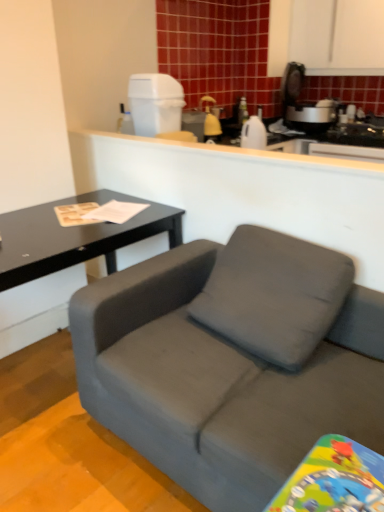
Question: Does black matte table at left appear on the left side of white plastic trash can at upper center, placed as the second appliance when sorted from back to front?

Choices:
 (A) no
 (B) yes

Answer: (B)

Question: From the image's perspective, is black matte table at left on top of white plastic trash can at upper center, placed as the second appliance when sorted from back to front?

Choices:
 (A) yes
 (B) no

Answer: (B)

Question: Considering the relative positions of black matte table at left and white plastic trash can at upper center, positioned as the 1th appliance in left-to-right order, in the image provided, is black matte table at left in front of white plastic trash can at upper center, positioned as the 1th appliance in left-to-right order,?

Choices:
 (A) no
 (B) yes

Answer: (B)

Question: Is black matte table at left turned away from white plastic trash can at upper center, placed as the second appliance when sorted from back to front?

Choices:
 (A) yes
 (B) no

Answer: (B)

Question: Would you say white plastic trash can at upper center, which is counted as the second appliance, starting from the right, is part of black matte table at left's contents?

Choices:
 (A) yes
 (B) no

Answer: (B)

Question: Is black matte table at left further to the viewer compared to white plastic trash can at upper center, which is counted as the 1th appliance, starting from the front?

Choices:
 (A) no
 (B) yes

Answer: (A)

Question: Does white plastic trash can at upper center, which is counted as the 1th appliance, starting from the front, have a greater height compared to black matte table at left?

Choices:
 (A) no
 (B) yes

Answer: (A)

Question: From the image's perspective, does white plastic trash can at upper center, which is counted as the 1th appliance, starting from the front, appear lower than black matte table at left?

Choices:
 (A) yes
 (B) no

Answer: (B)

Question: Is white plastic trash can at upper center, which is counted as the 1th appliance, starting from the front, aimed at black matte table at left?

Choices:
 (A) yes
 (B) no

Answer: (B)

Question: Does white plastic trash can at upper center, which is counted as the 1th appliance, starting from the front, have a lesser height compared to black matte table at left?

Choices:
 (A) yes
 (B) no

Answer: (A)

Question: Is white plastic trash can at upper center, placed as the second appliance when sorted from back to front, facing away from black matte table at left?

Choices:
 (A) yes
 (B) no

Answer: (B)

Question: Is white plastic trash can at upper center, which is counted as the 1th appliance, starting from the front, not within black matte table at left?

Choices:
 (A) no
 (B) yes

Answer: (B)

Question: Would you say matte gray couch at center is part of matte yellow spray bottle at upper center, the first appliance from the right,'s contents?

Choices:
 (A) yes
 (B) no

Answer: (B)